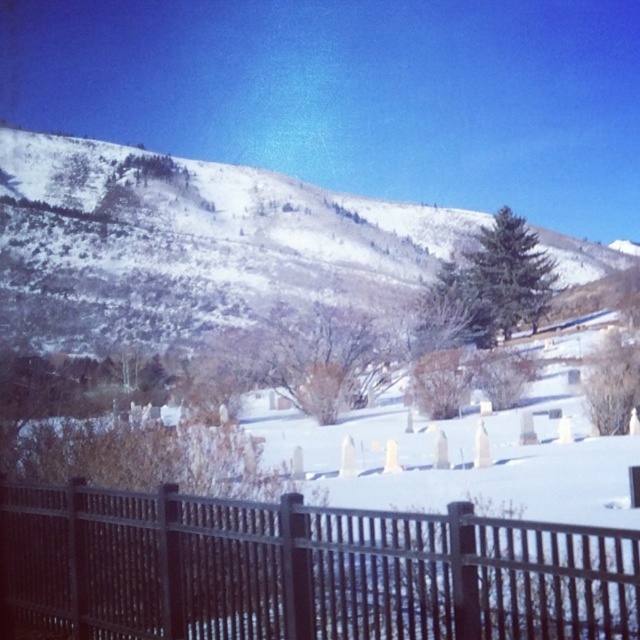
Based on the photo, you are standing in front of the black metal fence at lower center and looking towards the snowy textured hillside at upper center. Which object appears larger in the scene?

The snowy textured hillside at upper center appears larger than the black metal fence at lower center.

You are standing at the foot of the hill and looking towards the snowy textured hillside at upper center. Is the black metal fence at lower center blocking your view of the hillside?

The black metal fence at lower center is in front of the snowy textured hillside at upper center, so yes, the fence is blocking your view of the hillside.